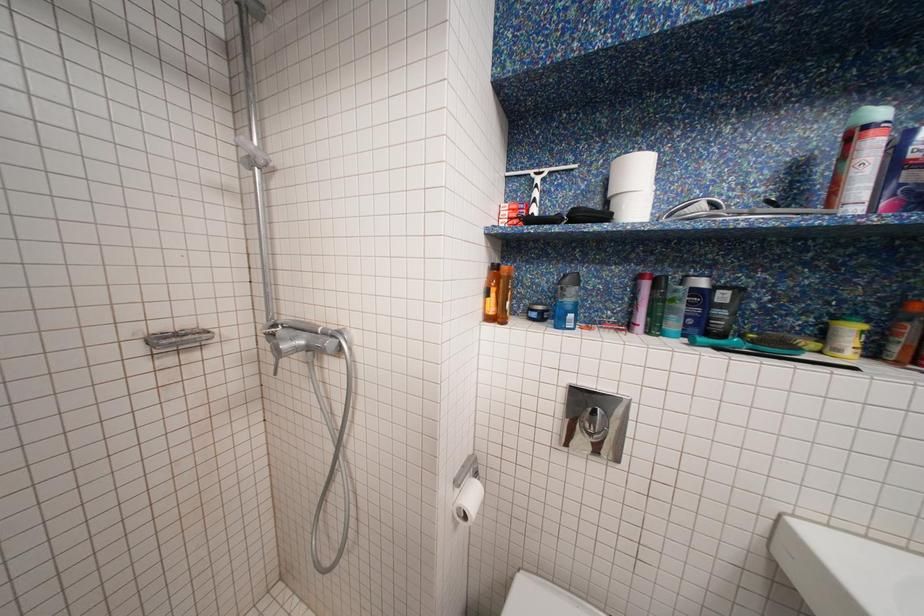
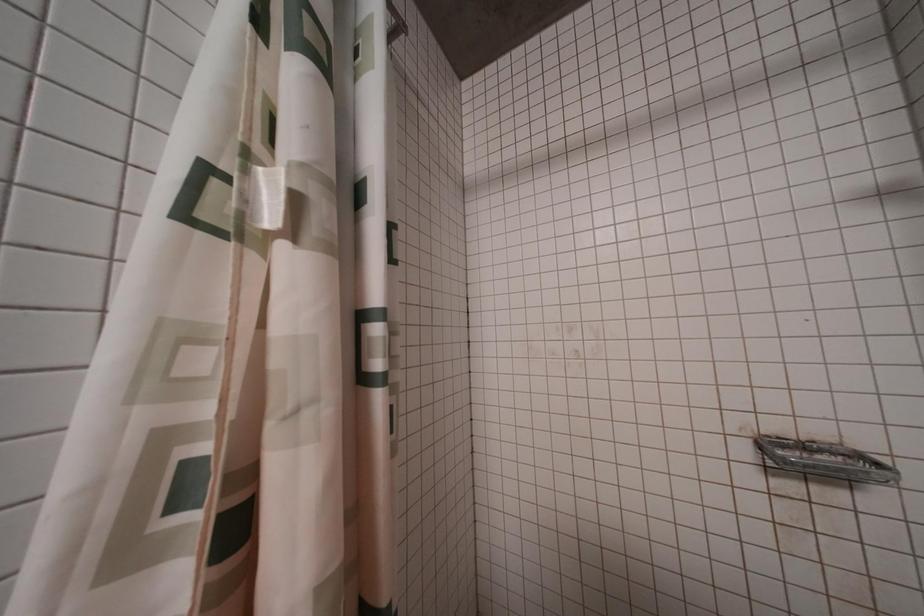
Question: Based on the continuous images, in which direction is the camera rotating? Reply with the corresponding letter.

Choices:
 (A) Left
 (B) Right
 (C) Up
 (D) Down

Answer: (A)